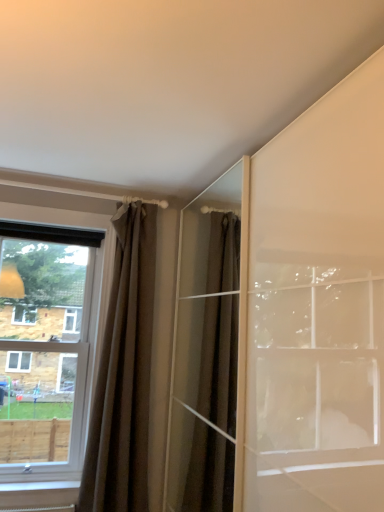
What do you see at coordinates (124, 373) in the screenshot? I see `brown fabric curtain at left` at bounding box center [124, 373].

The height and width of the screenshot is (512, 384). Identify the location of brown fabric curtain at left. (124, 373).

The height and width of the screenshot is (512, 384). Describe the element at coordinates (46, 356) in the screenshot. I see `clear glass window at left` at that location.

Where is `clear glass window at left`? clear glass window at left is located at coordinates (46, 356).

Where is `brown fabric curtain at left`? brown fabric curtain at left is located at coordinates (124, 373).

Considering the relative positions of clear glass window at left and brown fabric curtain at left in the image provided, is clear glass window at left to the right of brown fabric curtain at left from the viewer's perspective?

Incorrect, clear glass window at left is not on the right side of brown fabric curtain at left.

Is clear glass window at left in front of brown fabric curtain at left?

That is False.

Is point (10, 398) closer or farther from the camera than point (104, 482)?

Point (10, 398).

From the image's perspective, is clear glass window at left located above brown fabric curtain at left?

Yes, from the image's perspective, clear glass window at left is above brown fabric curtain at left.

From the picture: From a real-world perspective, who is located lower, clear glass window at left or brown fabric curtain at left?

clear glass window at left.

Considering the sizes of objects clear glass window at left and brown fabric curtain at left in the image provided, who is wider, clear glass window at left or brown fabric curtain at left?

clear glass window at left is wider.

Who is shorter, clear glass window at left or brown fabric curtain at left?

With less height is clear glass window at left.

Which of these two, clear glass window at left or brown fabric curtain at left, is bigger?

clear glass window at left is bigger.

Is brown fabric curtain at left inside clear glass window at left?

No, brown fabric curtain at left is not surrounded by clear glass window at left.

Is clear glass window at left touching brown fabric curtain at left?

No, clear glass window at left is not making contact with brown fabric curtain at left.

Is clear glass window at left turned away from brown fabric curtain at left?

No, clear glass window at left's orientation is not away from brown fabric curtain at left.

How different are the orientations of clear glass window at left and brown fabric curtain at left in degrees?

The angle between the facing direction of clear glass window at left and the facing direction of brown fabric curtain at left is 0.00108 degrees.

Where is `curtain that appears in front of the clear glass window at left`? curtain that appears in front of the clear glass window at left is located at coordinates 124,373.

Is brown fabric curtain at left at the right side of clear glass window at left?

Correct, you'll find brown fabric curtain at left to the right of clear glass window at left.

Who is more distant, brown fabric curtain at left or clear glass window at left?

clear glass window at left is further away from the camera.

Is point (94, 483) behind point (6, 441)?

No, it is in front of (6, 441).

From the image's perspective, which is below, brown fabric curtain at left or clear glass window at left?

brown fabric curtain at left is shown below in the image.

From a real-world perspective, who is located lower, brown fabric curtain at left or clear glass window at left?

clear glass window at left.

Can you confirm if brown fabric curtain at left is thinner than clear glass window at left?

Indeed, brown fabric curtain at left has a lesser width compared to clear glass window at left.

Which of these two, brown fabric curtain at left or clear glass window at left, stands taller?

brown fabric curtain at left.

Who is smaller, brown fabric curtain at left or clear glass window at left?

brown fabric curtain at left is smaller.

Would you say brown fabric curtain at left is outside clear glass window at left?

Indeed, brown fabric curtain at left is completely outside clear glass window at left.

Consider the image. Is brown fabric curtain at left not near clear glass window at left?

No, brown fabric curtain at left is not far away from clear glass window at left.

Is brown fabric curtain at left facing towards clear glass window at left?

No, brown fabric curtain at left is not aimed at clear glass window at left.

In the scene shown: Can you tell me how much brown fabric curtain at left and clear glass window at left differ in facing direction?

There is a 0.00108-degree angle between the facing directions of brown fabric curtain at left and clear glass window at left.

Measure the distance between brown fabric curtain at left and clear glass window at left.

They are 16.00 inches apart.

Locate an element on the screen. The image size is (384, 512). window located above the brown fabric curtain at left (from the image's perspective) is located at coordinates (46, 356).

The width and height of the screenshot is (384, 512). I want to click on window on the left of brown fabric curtain at left, so click(46, 356).

Image resolution: width=384 pixels, height=512 pixels. What are the coordinates of `window that is under the brown fabric curtain at left (from a real-world perspective)` in the screenshot? It's located at (46, 356).